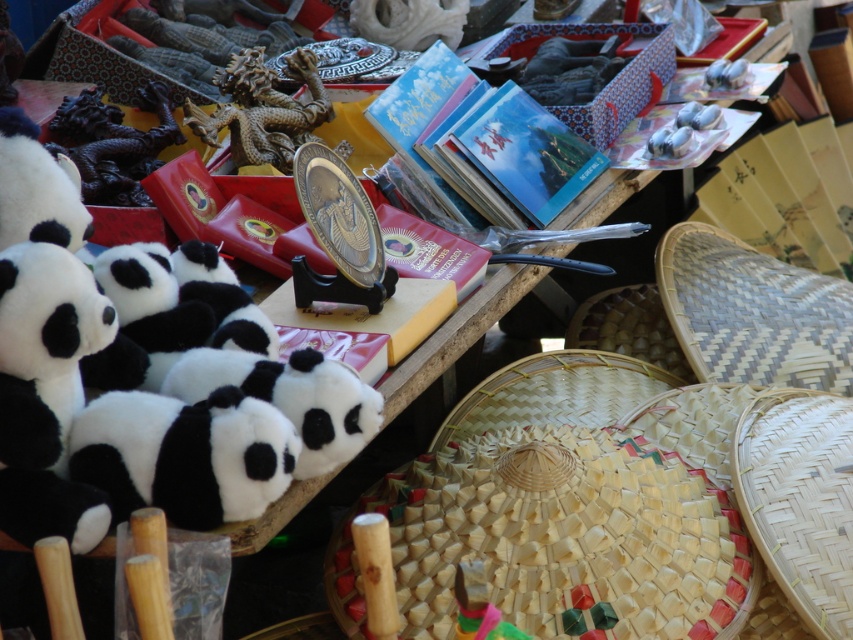
Question: Is soft plush panda at left bigger than woven bamboo basket at lower right?

Choices:
 (A) no
 (B) yes

Answer: (A)

Question: Is natural woven straw hat at lower right to the right of black plush panda at center from the viewer's perspective?

Choices:
 (A) no
 (B) yes

Answer: (B)

Question: Estimate the real-world distances between objects in this image. Which object is farther from the soft plush panda at left?

Choices:
 (A) metallic dragon at center
 (B) black plush panda at center

Answer: (A)

Question: In this image, where is soft plush panda at left located relative to metallic dragon at center?

Choices:
 (A) right
 (B) left

Answer: (B)

Question: Which point is closer to the camera?

Choices:
 (A) soft plush panda at left
 (B) woven bamboo basket at lower right

Answer: (A)

Question: Among these points, which one is farthest from the camera?

Choices:
 (A) (589, 554)
 (B) (315, 106)
 (C) (35, 436)
 (D) (685, 276)

Answer: (D)